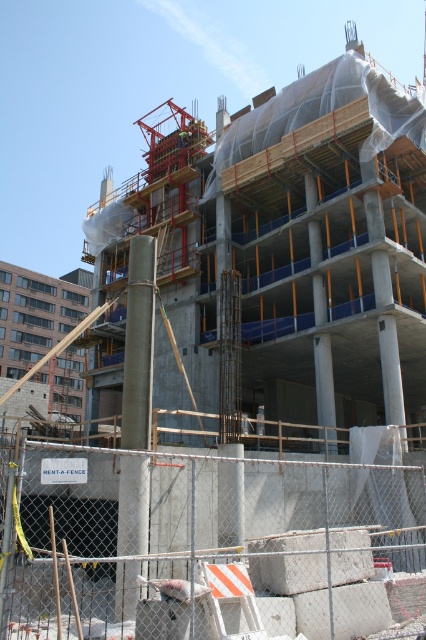
Question: Which of the following is the closest to the observer?

Choices:
 (A) (268, 476)
 (B) (141, 256)

Answer: (B)

Question: Which object is closer to the camera taking this photo?

Choices:
 (A) white concrete blocks at lower center
 (B) concrete column at center

Answer: (A)

Question: Which of the following is the farthest from the observer?

Choices:
 (A) concrete column at center
 (B) white concrete blocks at lower center

Answer: (A)

Question: In this image, where is white concrete blocks at lower center located relative to concrete column at center?

Choices:
 (A) left
 (B) right

Answer: (B)

Question: In this image, where is white concrete blocks at lower center located relative to concrete column at center?

Choices:
 (A) right
 (B) left

Answer: (A)

Question: Can you confirm if white concrete blocks at lower center is thinner than concrete column at center?

Choices:
 (A) no
 (B) yes

Answer: (A)